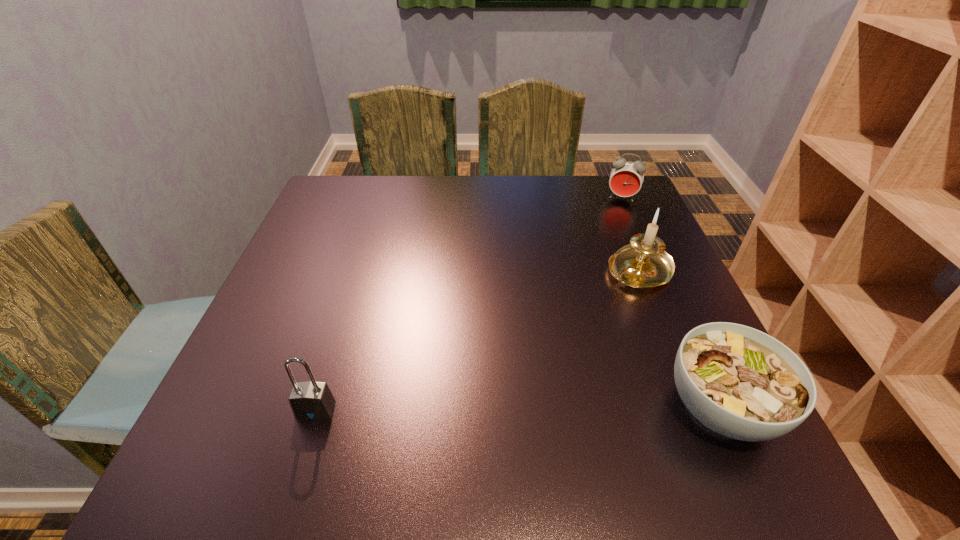
The width and height of the screenshot is (960, 540). In order to click on the leftmost object in this screenshot , I will do `click(312, 400)`.

The width and height of the screenshot is (960, 540). Find the location of `the shortest object`. the shortest object is located at coordinates (740, 382).

The width and height of the screenshot is (960, 540). What are the coordinates of `the third nearest object` in the screenshot? It's located at (644, 263).

Find the location of a particular element. candle holder is located at coordinates (644, 263).

Where is `alarm clock`? The height and width of the screenshot is (540, 960). alarm clock is located at coordinates (626, 178).

At what (x,y) coordinates should I click in order to perform the action: click on vacant space situated 0.230m on the left of the soup bowl. Please return your answer as a coordinate pair (x, y). Image resolution: width=960 pixels, height=540 pixels. Looking at the image, I should click on (529, 407).

What are the coordinates of `vacant position located 0.160m on the handle side of the third nearest object` in the screenshot? It's located at (577, 325).

Locate an element on the screen. The width and height of the screenshot is (960, 540). free space located on the handle side of the third nearest object is located at coordinates (525, 372).

Image resolution: width=960 pixels, height=540 pixels. I want to click on free space located on the handle side of the third nearest object, so click(x=608, y=298).

You are a GUI agent. You are given a task and a screenshot of the screen. Output one action in this format:
    pyautogui.click(x=<x>, y=<y>)
    Task: Click on the free spot located 0.060m on the face of the farthest object
    
    Given the screenshot: What is the action you would take?
    pyautogui.click(x=616, y=217)